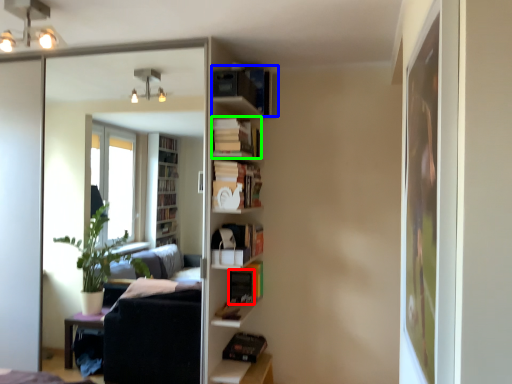
Question: Based on their relative distances, which object is farther from book (highlighted by a red box)? Choose from book (highlighted by a blue box) and book (highlighted by a green box).

Choices:
 (A) book
 (B) book

Answer: (A)